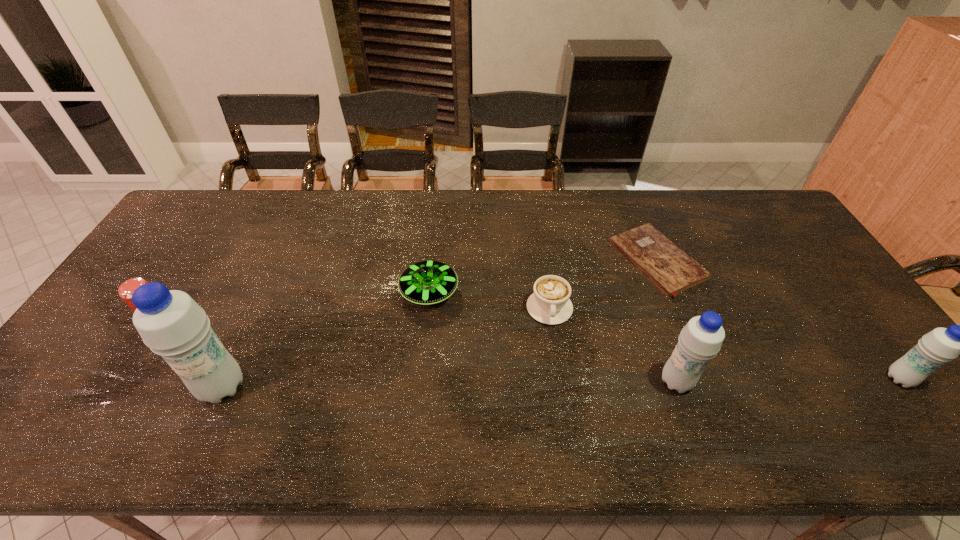
Image resolution: width=960 pixels, height=540 pixels. I want to click on free space between the tallest object and the fourth object from right to left, so click(x=386, y=348).

Identify the location of empty location between the rightmost object and the Bible. (779, 320).

The image size is (960, 540). I want to click on vacant space that's between the second object from left to right and the second tallest water bottle, so click(449, 384).

Locate an element on the screen. Image resolution: width=960 pixels, height=540 pixels. free area in between the saucer and the leftmost object is located at coordinates (293, 304).

Image resolution: width=960 pixels, height=540 pixels. Find the location of `blank region between the fourth object from left to right and the rightmost water bottle`. blank region between the fourth object from left to right and the rightmost water bottle is located at coordinates (725, 343).

Image resolution: width=960 pixels, height=540 pixels. I want to click on vacant space that's between the sixth shortest object and the cappuccino, so click(612, 345).

Identify the location of vacant area between the fourth shortest object and the fourth object from left to right. This screenshot has width=960, height=540. (353, 313).

I want to click on object that is the third nearest to the tallest object, so click(550, 304).

Locate which object ranks third in proximity to the beer can. Please provide its 2D coordinates. Your answer should be formatted as a tuple, i.e. [(x, y)], where the tuple contains the x and y coordinates of a point satisfying the conditions above.

[(550, 304)]

Choose which water bottle is the nearest neighbor to the cappuccino. Please provide its 2D coordinates. Your answer should be formatted as a tuple, i.e. [(x, y)], where the tuple contains the x and y coordinates of a point satisfying the conditions above.

[(700, 340)]